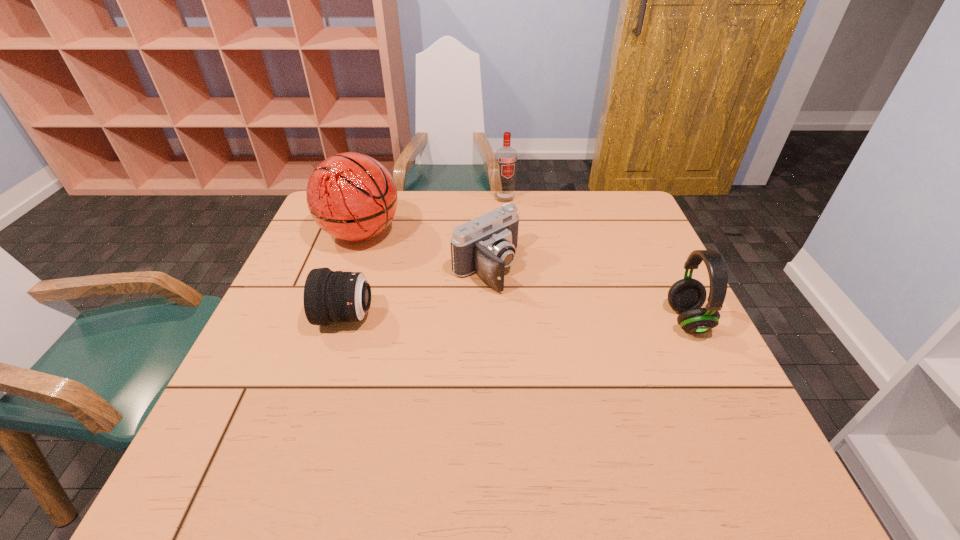
Where is `vacant space located 0.200m on the side with spill of the basketball`? vacant space located 0.200m on the side with spill of the basketball is located at coordinates (437, 280).

The image size is (960, 540). What are the coordinates of `vacant space located on the side with spill of the basketball` in the screenshot? It's located at coord(483,309).

At what (x,y) coordinates should I click in order to perform the action: click on free space located 0.050m at the front of the camera with an open lens cover. Please return your answer as a coordinate pair (x, y). The width and height of the screenshot is (960, 540). Looking at the image, I should click on (522, 300).

Where is `vacant position located 0.070m at the front of the camera with an open lens cover`? The width and height of the screenshot is (960, 540). vacant position located 0.070m at the front of the camera with an open lens cover is located at coordinates (528, 305).

You are a GUI agent. You are given a task and a screenshot of the screen. Output one action in this format:
    pyautogui.click(x=<x>, y=<y>)
    Task: Click on the free spot located 0.200m at the front of the camera with an open lens cover
    
    Given the screenshot: What is the action you would take?
    pyautogui.click(x=567, y=335)

Identify the location of vacant space situated 0.140m on the front label of the vodka. (517, 227).

I want to click on vacant space situated on the front label of the vodka, so click(538, 273).

Locate an element on the screen. Image resolution: width=960 pixels, height=540 pixels. free space located 0.120m on the front label of the vodka is located at coordinates (516, 224).

You are a GUI agent. You are given a task and a screenshot of the screen. Output one action in this format:
    pyautogui.click(x=<x>, y=<y>)
    Task: Click on the basketball at the far edge
    
    Given the screenshot: What is the action you would take?
    351,196

This screenshot has width=960, height=540. I want to click on vodka situated at the far edge, so click(x=506, y=157).